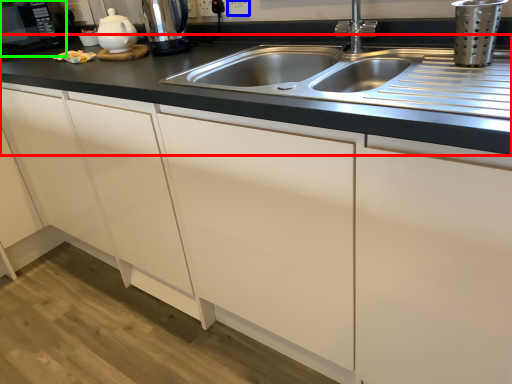
Question: Which object is the farthest from countertop (highlighted by a red box)? Choose among these: electric outlet (highlighted by a blue box) or appliance (highlighted by a green box).

Choices:
 (A) electric outlet
 (B) appliance

Answer: (B)